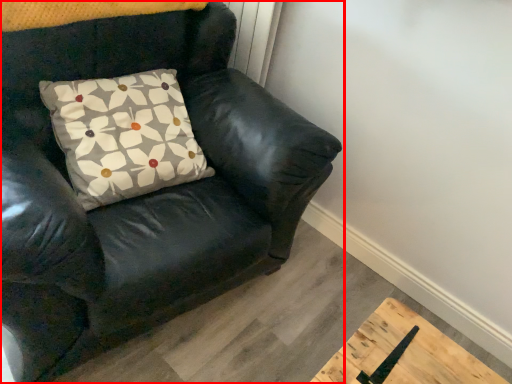
Question: From the image's perspective, where is chair (annotated by the red box) located relative to pillow?

Choices:
 (A) above
 (B) below

Answer: (B)